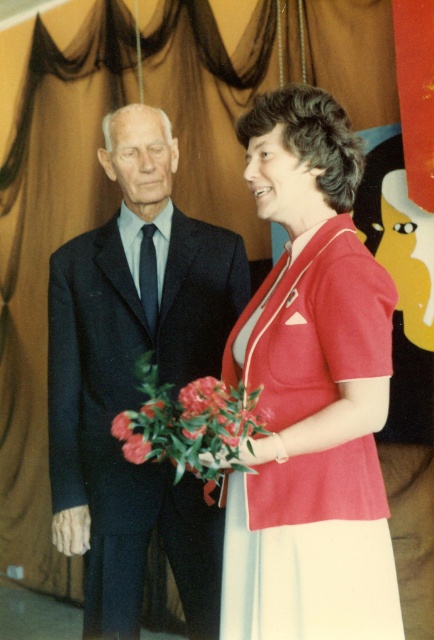
Question: Is vivid red petals at center positioned before matte red flower at center?

Choices:
 (A) yes
 (B) no

Answer: (A)

Question: Estimate the real-world distances between objects in this image. Which object is closer to the matte red flower at center?

Choices:
 (A) fluffy pink rose at center
 (B) matte red dress at center

Answer: (A)

Question: Can you confirm if glossy floral bouquet at center is positioned below matte red flower at center?

Choices:
 (A) yes
 (B) no

Answer: (B)

Question: Considering the relative positions of matte red dress at center and vivid pink petals at lower left in the image provided, where is matte red dress at center located with respect to vivid pink petals at lower left?

Choices:
 (A) right
 (B) left

Answer: (A)

Question: Which object appears farthest from the camera in this image?

Choices:
 (A) vivid red petals at center
 (B) matte red dress at center
 (C) matte black suit at left
 (D) matte red flower at center

Answer: (C)

Question: Among these objects, which one is farthest from the camera?

Choices:
 (A) fluffy pink rose at center
 (B) matte red dress at center

Answer: (A)